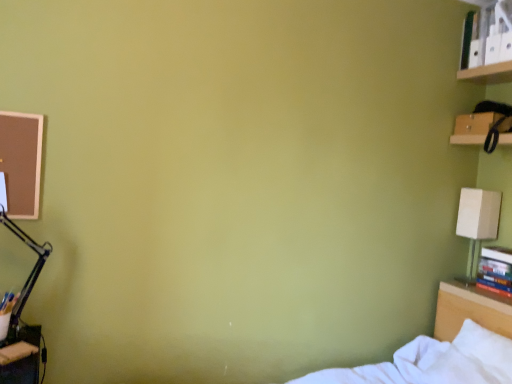
Question: Do you think white cardboard book at upper right, arranged as the 1th book when viewed from the top, is within wooden shelf at upper right, or outside of it?

Choices:
 (A) inside
 (B) outside

Answer: (B)

Question: In the image, is white cardboard book at upper right, marked as the second book in a bottom-to-top arrangement, positioned in front of or behind wooden shelf at upper right?

Choices:
 (A) front
 (B) behind

Answer: (A)

Question: Which object is the farthest from the hardcover books at right, arranged as the first book when ordered from the bottom?

Choices:
 (A) beige fabric lampshade at upper right
 (B) wooden shelf at upper right
 (C) white soft bed at lower right
 (D) white cardboard book at upper right, arranged as the 1th book when viewed from the top
 (E) wooden desk at lower left

Answer: (E)

Question: Estimate the real-world distances between objects in this image. Which object is closer to the wooden shelf at upper right?

Choices:
 (A) wooden desk at lower left
 (B) beige fabric lampshade at upper right
 (C) hardcover books at right, which appears as the second book when viewed from the top
 (D) white soft bed at lower right
 (E) white cardboard book at upper right, marked as the second book in a bottom-to-top arrangement

Answer: (B)